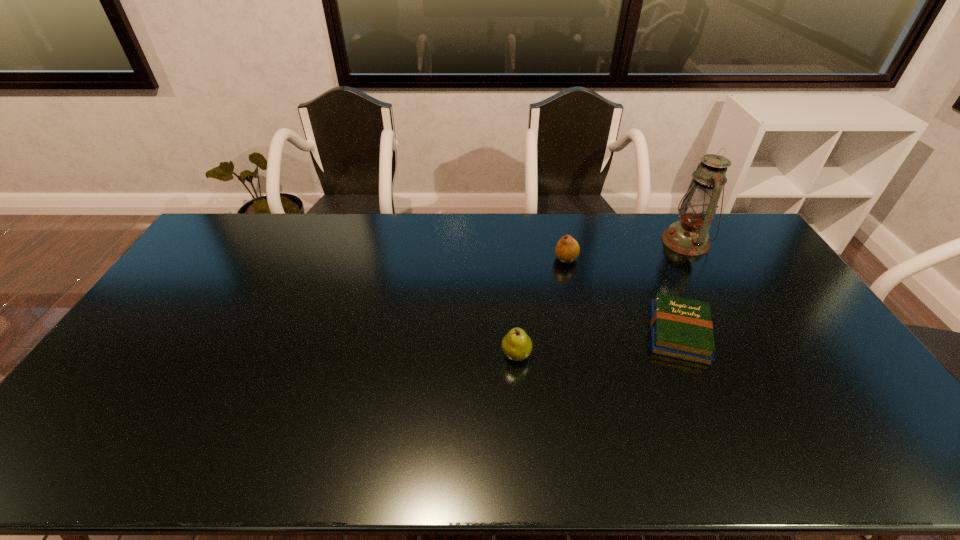
You are a GUI agent. You are given a task and a screenshot of the screen. Output one action in this format:
    pyautogui.click(x=<x>, y=<y>)
    Task: Click on the tallest object
    Image resolution: width=960 pixels, height=540 pixels.
    Given the screenshot: What is the action you would take?
    pyautogui.click(x=689, y=236)

You are a GUI agent. You are given a task and a screenshot of the screen. Output one action in this format:
    pyautogui.click(x=<x>, y=<y>)
    Task: Click on the nearer pear
    This screenshot has height=540, width=960.
    Given the screenshot: What is the action you would take?
    pyautogui.click(x=516, y=345)

The width and height of the screenshot is (960, 540). Identify the location of the leftmost object. (516, 345).

Where is `the right pear`? The width and height of the screenshot is (960, 540). the right pear is located at coordinates (567, 249).

The image size is (960, 540). What are the coordinates of `the second object from left to right` in the screenshot? It's located at (567, 249).

Identify the location of the shortest object. (681, 328).

You are a GUI agent. You are given a task and a screenshot of the screen. Output one action in this format:
    pyautogui.click(x=<x>, y=<y>)
    Task: Click on the vacant space positioned 0.230m on the front of the oil lamp
    
    Given the screenshot: What is the action you would take?
    pyautogui.click(x=722, y=307)

The image size is (960, 540). I want to click on vacant space located 0.290m on the back of the nearer pear, so click(510, 276).

Locate an element on the screen. Image resolution: width=960 pixels, height=540 pixels. vacant space positioned 0.120m on the right of the third object from right to left is located at coordinates (612, 259).

Image resolution: width=960 pixels, height=540 pixels. I want to click on free space located on the back of the shortest object, so click(637, 239).